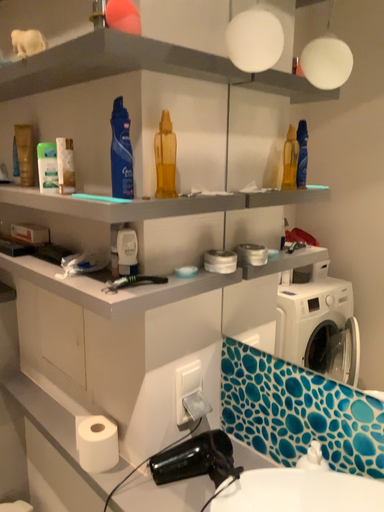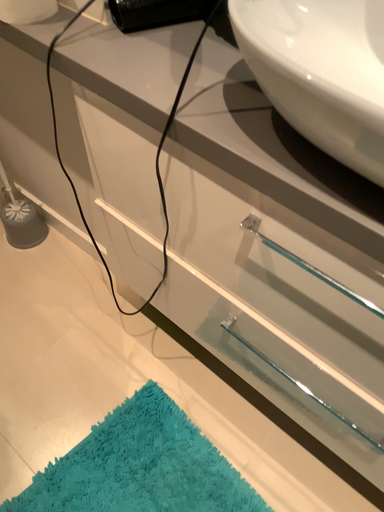
Question: Which way did the camera rotate in the video?

Choices:
 (A) rotated left
 (B) rotated right

Answer: (B)